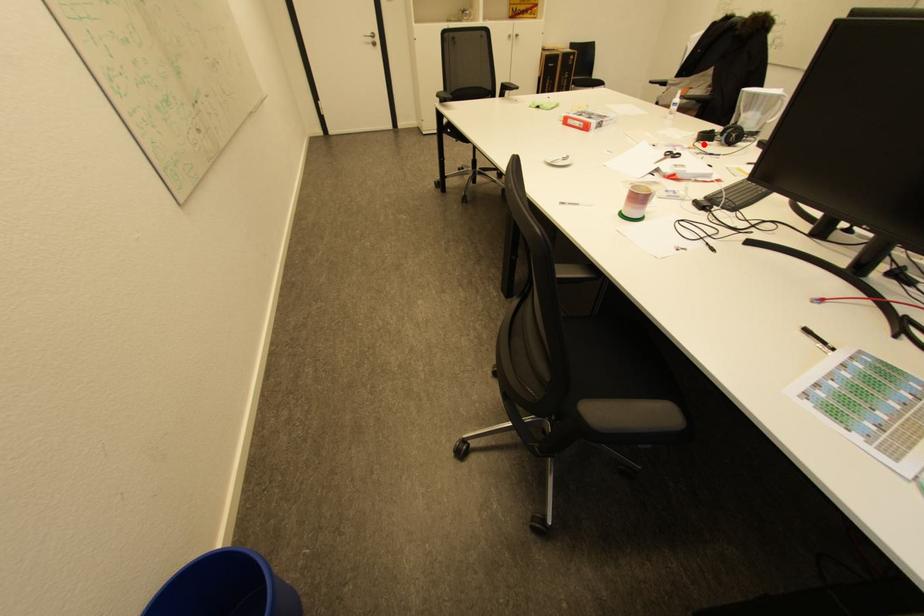
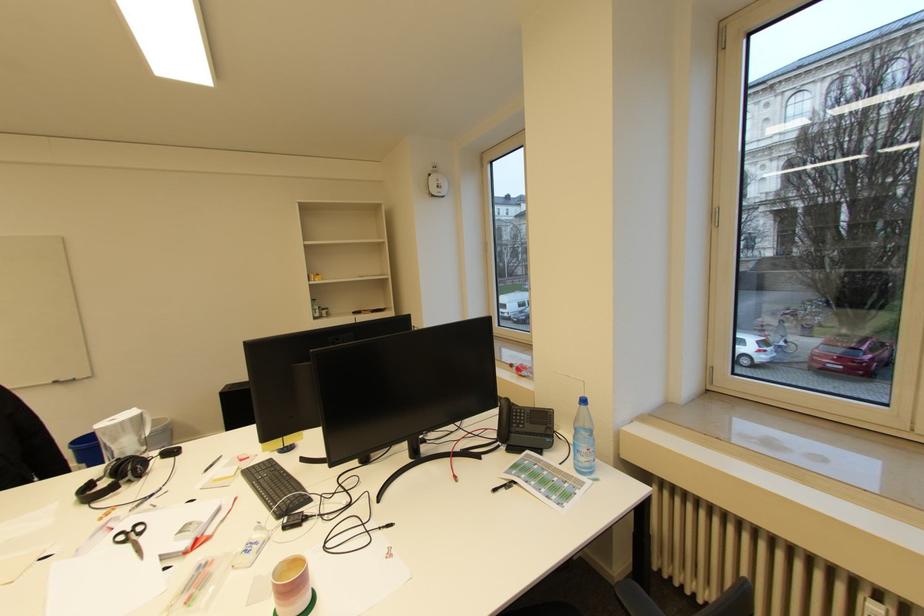
Find the pixel in the second image that matches the highlighted location in the first image.

(100, 506)